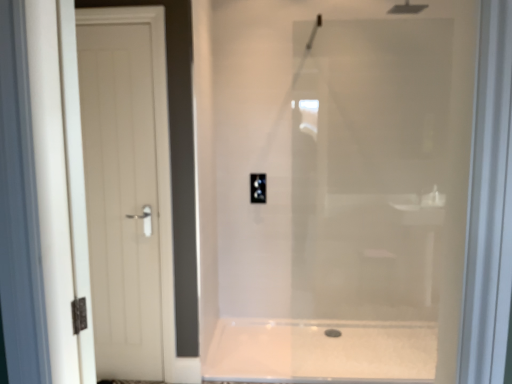
What do you see at coordinates (258, 187) in the screenshot? This screenshot has width=512, height=384. I see `black plastic outlet at center` at bounding box center [258, 187].

Identify the location of black rubber drain at lower center. Image resolution: width=512 pixels, height=384 pixels. (332, 333).

Where is `white matte door at left`? Image resolution: width=512 pixels, height=384 pixels. white matte door at left is located at coordinates (121, 198).

Where is `white glossy bath at center`? The image size is (512, 384). white glossy bath at center is located at coordinates (321, 351).

You are a GUI agent. You are given a task and a screenshot of the screen. Output one action in this format:
    pyautogui.click(x=<x>, y=<y>)
    Task: Click on the black plastic outlet at center
    This screenshot has height=384, width=512.
    Given the screenshot: What is the action you would take?
    coord(258,187)

Which is more to the left, white glossy bath at center or black plastic outlet at center?

black plastic outlet at center.

Does white glossy bath at center have a larger size compared to black plastic outlet at center?

Yes.

Is white glossy bath at center not near black plastic outlet at center?

Yes, white glossy bath at center is far from black plastic outlet at center.

How many degrees apart are the facing directions of white glossy bath at center and black plastic outlet at center?

The angular difference between white glossy bath at center and black plastic outlet at center is 1.36 degrees.

Considering the sizes of objects white matte door at left and white glossy bath at center in the image provided, who is thinner, white matte door at left or white glossy bath at center?

With smaller width is white matte door at left.

Between white matte door at left and white glossy bath at center, which one has smaller size?

Smaller between the two is white matte door at left.

From a real-world perspective, which object rests below the other?

white glossy bath at center is physically lower.

Is white matte door at left directly adjacent to white glossy bath at center?

No, white matte door at left is not in contact with white glossy bath at center.

Image resolution: width=512 pixels, height=384 pixels. Identify the location of bath on the right of white matte door at left. (321, 351).

From the image's perspective, which is above, white glossy bath at center or white matte door at left?

From the image's view, white matte door at left is above.

From their relative heights in the image, would you say white glossy bath at center is taller or shorter than white matte door at left?

white glossy bath at center is shorter than white matte door at left.

Does white glossy bath at center come in front of white matte door at left?

No, it is behind white matte door at left.

Is white glossy bath at center not inside black rubber drain at lower center?

Yes, white glossy bath at center is not within black rubber drain at lower center.

Looking at their sizes, would you say white glossy bath at center is wider or thinner than black rubber drain at lower center?

white glossy bath at center is wider than black rubber drain at lower center.

From the image's perspective, relative to black rubber drain at lower center, is white glossy bath at center above or below?

Based on their image positions, white glossy bath at center is located beneath black rubber drain at lower center.

From a real-world perspective, is white glossy bath at center above or below black rubber drain at lower center?

From a real-world perspective, white glossy bath at center is physically above black rubber drain at lower center.

Which point is more distant from viewer, (102, 330) or (261, 176)?

The point (261, 176) is more distant.

From a real-world perspective, is white matte door at left beneath black plastic outlet at center?

Indeed, from a real-world perspective, white matte door at left is positioned beneath black plastic outlet at center.

Which of these two, white matte door at left or black plastic outlet at center, stands shorter?

black plastic outlet at center.

From the image's perspective, is white matte door at left located above black plastic outlet at center?

Actually, white matte door at left appears below black plastic outlet at center in the image.

Does black rubber drain at lower center appear on the left side of white glossy bath at center?

No.

Considering the relative sizes of black rubber drain at lower center and white glossy bath at center in the image provided, is black rubber drain at lower center shorter than white glossy bath at center?

Correct, black rubber drain at lower center is not as tall as white glossy bath at center.

From the image's perspective, is black rubber drain at lower center located above or below white glossy bath at center?

Clearly, from the image's perspective, black rubber drain at lower center is above white glossy bath at center.

Choose the correct answer: Is black rubber drain at lower center inside white glossy bath at center or outside it?

The correct answer is: inside.

Based on the photo, measure the distance between white matte door at left and black rubber drain at lower center.

Answer: white matte door at left and black rubber drain at lower center are 1.74 meters apart from each other.

Is white matte door at left aimed at black rubber drain at lower center?

A: No.

Can we say white matte door at left lies outside black rubber drain at lower center?

That's correct, white matte door at left is outside of black rubber drain at lower center.

Does point (113, 163) come farther from viewer compared to point (334, 329)?

No, (113, 163) is in front of (334, 329).

This screenshot has height=384, width=512. Find the location of `bath below the black plastic outlet at center (from a real-world perspective)`. bath below the black plastic outlet at center (from a real-world perspective) is located at coordinates (321, 351).

Where is `bath below the white matte door at left (from the image's perspective)`? The image size is (512, 384). bath below the white matte door at left (from the image's perspective) is located at coordinates (321, 351).

When comparing their distances from black plastic outlet at center, does white glossy bath at center or black rubber drain at lower center seem closer?

Based on the image, black rubber drain at lower center appears to be nearer to black plastic outlet at center.

Based on their spatial positions, is black rubber drain at lower center or white glossy bath at center closer to black plastic outlet at center?

black rubber drain at lower center lies closer to black plastic outlet at center than the other object.

Consider the image. Considering their positions, is white glossy bath at center positioned closer to black rubber drain at lower center than white matte door at left?

white glossy bath at center is positioned closer to the anchor black rubber drain at lower center.

Which object lies further to the anchor point white matte door at left, black plastic outlet at center or white glossy bath at center?

The object further to white matte door at left is black plastic outlet at center.

Looking at the image, which one is located further to black rubber drain at lower center, black plastic outlet at center or white matte door at left?

white matte door at left is further to black rubber drain at lower center.

Estimate the real-world distances between objects in this image. Which object is closer to white matte door at left, black rubber drain at lower center or black plastic outlet at center?

Among the two, black plastic outlet at center is located nearer to white matte door at left.

Based on their spatial positions, is black plastic outlet at center or white matte door at left further from white glossy bath at center?

black plastic outlet at center.

Based on their spatial positions, is white glossy bath at center or black rubber drain at lower center further from white matte door at left?

Among the two, black rubber drain at lower center is located further to white matte door at left.

The image size is (512, 384). Find the location of `bath situated between white matte door at left and black rubber drain at lower center from left to right`. bath situated between white matte door at left and black rubber drain at lower center from left to right is located at coordinates (321, 351).

Identify the location of drain between black plastic outlet at center and white glossy bath at center vertically. This screenshot has height=384, width=512. (332, 333).

You are a GUI agent. You are given a task and a screenshot of the screen. Output one action in this format:
    pyautogui.click(x=<x>, y=<y>)
    Task: Click on the door between black plastic outlet at center and white glossy bath at center in the up-down direction
    The height and width of the screenshot is (384, 512).
    Given the screenshot: What is the action you would take?
    pyautogui.click(x=121, y=198)

The height and width of the screenshot is (384, 512). What are the coordinates of `electric outlet between white matte door at left and black rubber drain at lower center from left to right` in the screenshot? It's located at (258, 187).